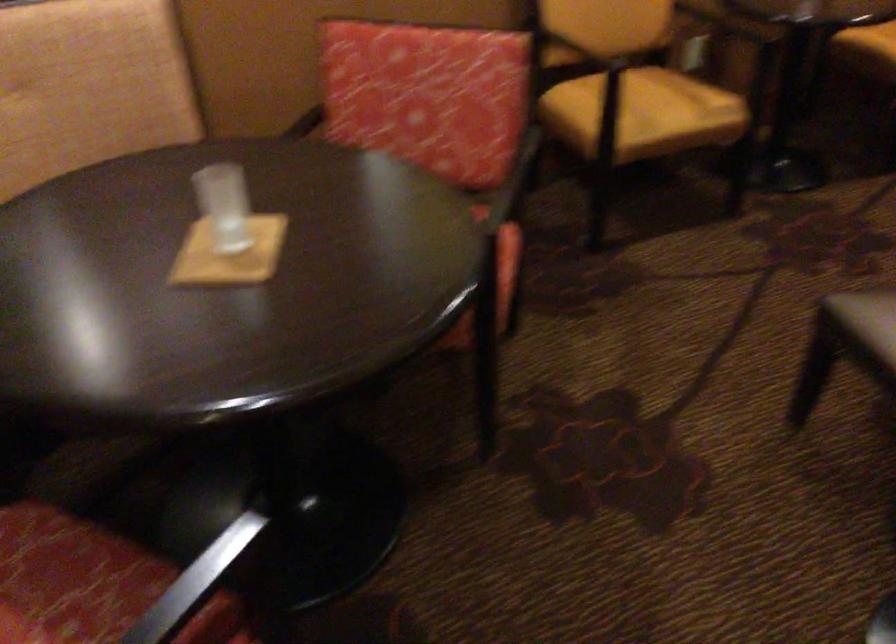
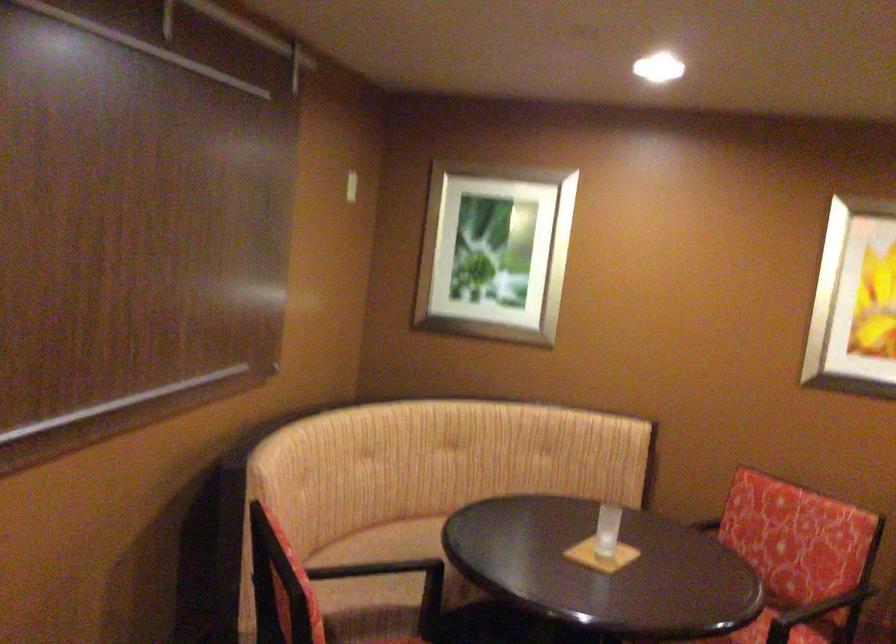
Where in the second image is the point corresponding to (504,174) from the first image?

(820, 614)